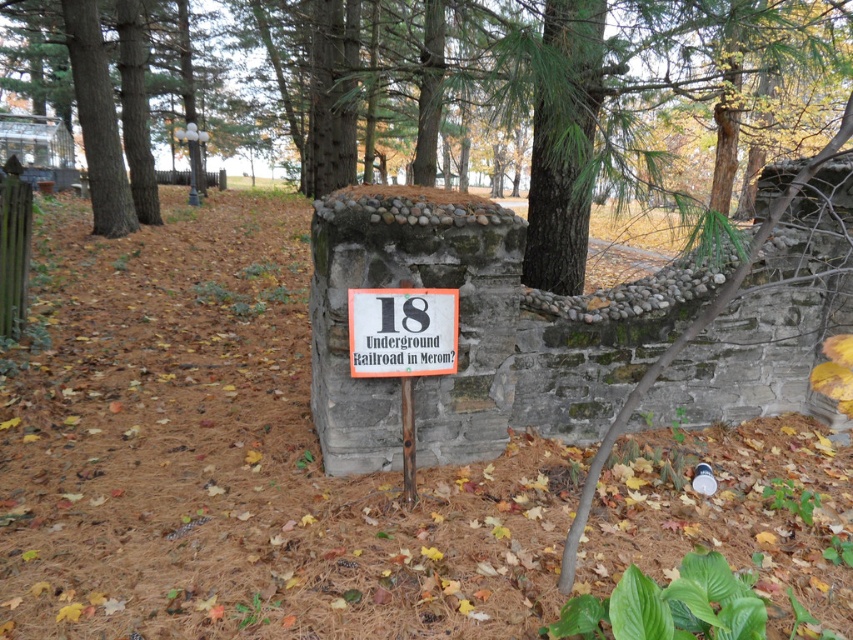
Question: Is green textured stone wall at center in front of white plastic sign at center?

Choices:
 (A) no
 (B) yes

Answer: (B)

Question: Can you confirm if green textured stone wall at center is positioned above white plastic sign at center?

Choices:
 (A) yes
 (B) no

Answer: (A)

Question: Which object appears closest to the camera in this image?

Choices:
 (A) white plastic sign at center
 (B) green textured stone wall at center

Answer: (B)

Question: Which of the following is the farthest from the observer?

Choices:
 (A) green textured stone wall at center
 (B) white plastic sign at center

Answer: (B)

Question: Does green textured stone wall at center have a greater width compared to white plastic sign at center?

Choices:
 (A) yes
 (B) no

Answer: (A)